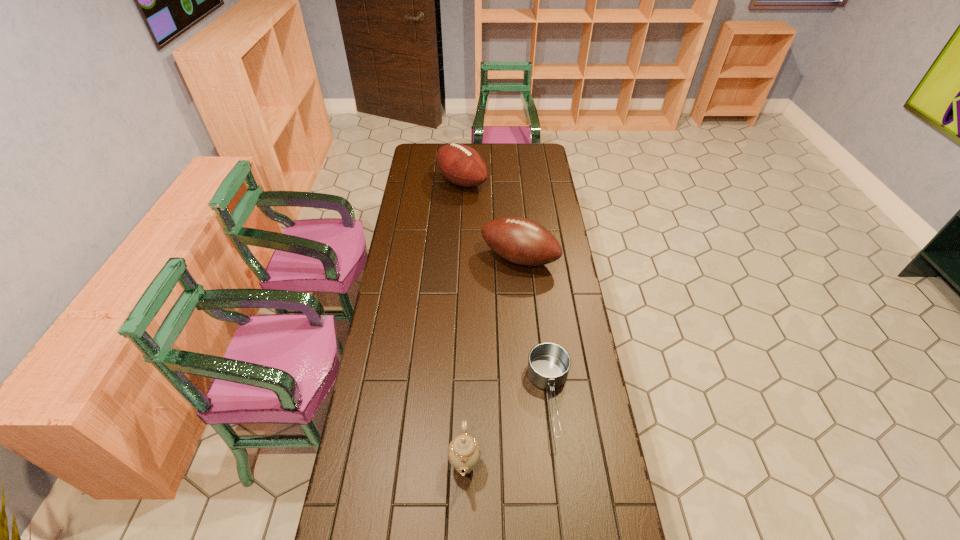
I want to click on saucepan situated at the right edge, so click(x=548, y=363).

Locate an element on the screen. The width and height of the screenshot is (960, 540). free region at the far edge is located at coordinates (489, 159).

Locate an element on the screen. vacant space at the left edge is located at coordinates click(430, 188).

In the image, there is a desktop. What are the coordinates of `vacant space at the right edge` in the screenshot? It's located at (540, 168).

The height and width of the screenshot is (540, 960). I want to click on vacant space at the far left corner of the desktop, so click(428, 161).

I want to click on vacant area at the far right corner of the desktop, so click(527, 152).

Where is `unoccupied position between the chinaware and the saucepan`? unoccupied position between the chinaware and the saucepan is located at coordinates (508, 430).

What are the coordinates of `vacant area that lies between the saucepan and the farthest object` in the screenshot? It's located at (506, 289).

The width and height of the screenshot is (960, 540). I want to click on free space between the nearer football (American) and the chinaware, so click(492, 361).

Locate an element on the screen. free space between the farther football (American) and the nearer football (American) is located at coordinates point(491,220).